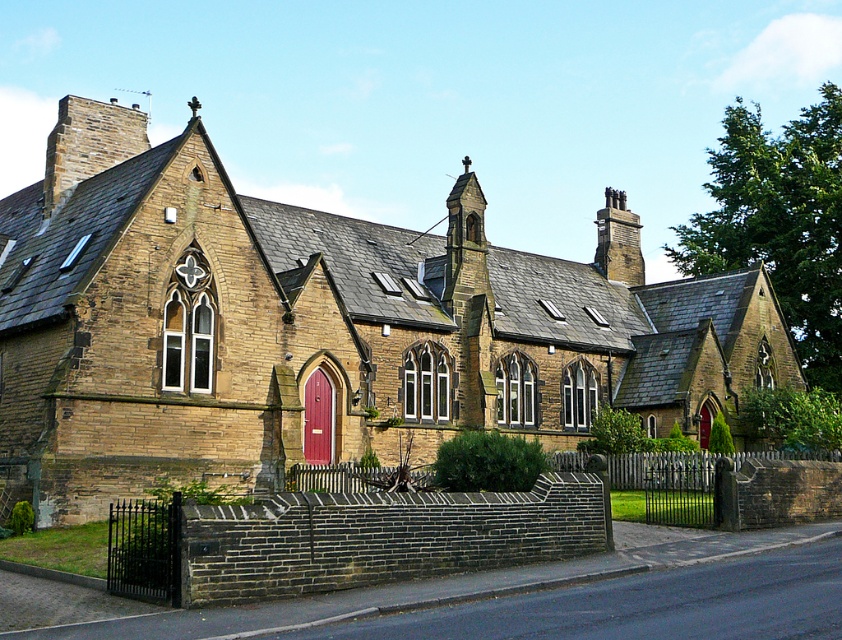
You are standing in a park and see the brown stone church at center. If you want to locate it precisely on a map, what are its coordinates?

The brown stone church at center is located at coordinates (318, 324).

Based on the photo, you are standing in front of the brown stone church at center and need to enter the matte wooden door at center. Is the door accessible from where you are standing?

The brown stone church at center is positioned over the matte wooden door at center, meaning the door is located beneath the church structure. Since you are standing in front of the church, the door should be accessible as it is directly in front of you.